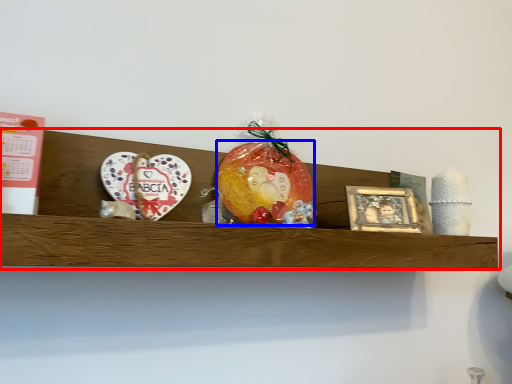
Question: Among these objects, which one is farthest to the camera, shelf (highlighted by a red box) or fruit (highlighted by a blue box)?

Choices:
 (A) shelf
 (B) fruit

Answer: (B)